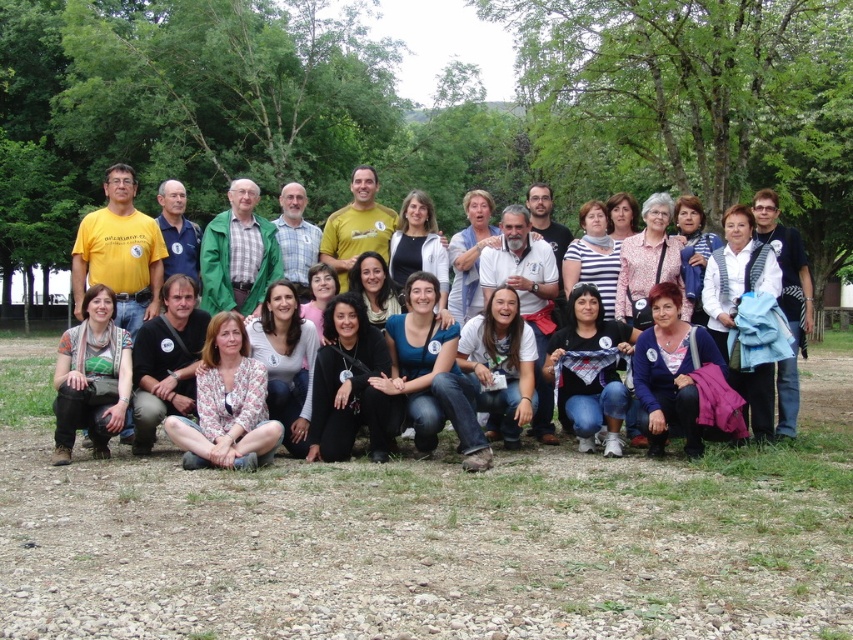
You are a GUI agent. You are given a task and a screenshot of the screen. Output one action in this format:
    pyautogui.click(x=<x>, y=<y>)
    Task: Click on the matte black scarf at lower left
    This screenshot has height=640, width=853.
    Given the screenshot: What is the action you would take?
    pyautogui.click(x=91, y=376)

Does matte black scarf at lower left have a greater height compared to light blue shirt at center?

Yes, matte black scarf at lower left is taller than light blue shirt at center.

Where is `matte black scarf at lower left`? This screenshot has width=853, height=640. matte black scarf at lower left is located at coordinates (91, 376).

Which is more to the left, matte black scarf at lower left or black cotton shirt at lower left?

From the viewer's perspective, matte black scarf at lower left appears more on the left side.

Is matte black scarf at lower left bigger than black cotton shirt at lower left?

Yes.

Is point (86, 324) less distant than point (184, 356)?

Yes.

The height and width of the screenshot is (640, 853). What are the coordinates of `matte black scarf at lower left` in the screenshot? It's located at (91, 376).

Does blue sweater at lower right have a greater height compared to black cotton shirt at lower left?

No, blue sweater at lower right is not taller than black cotton shirt at lower left.

Can you confirm if blue sweater at lower right is wider than black cotton shirt at lower left?

Indeed, blue sweater at lower right has a greater width compared to black cotton shirt at lower left.

Is point (650, 305) less distant than point (181, 282)?

Yes, point (650, 305) is closer to viewer.

Identify the location of blue sweater at lower right. [x=670, y=372].